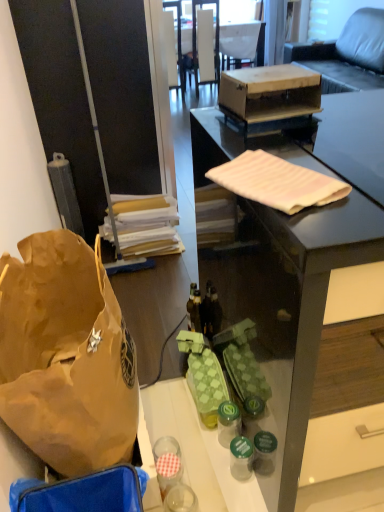
This screenshot has width=384, height=512. In order to click on free space in front of wooden box at center in this screenshot , I will do `click(300, 125)`.